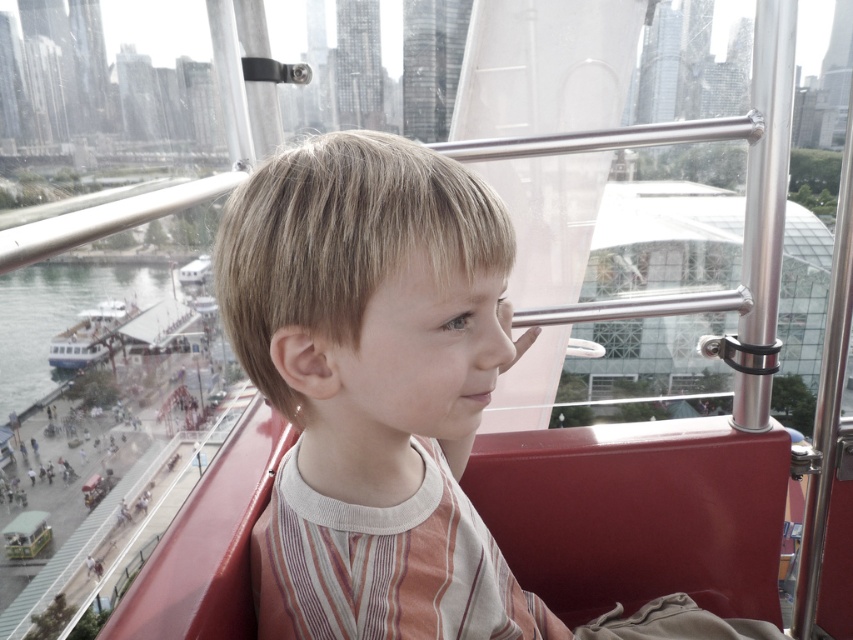
Question: Can you confirm if light brown hair at center is positioned to the right of white matte boat at lower left?

Choices:
 (A) no
 (B) yes

Answer: (B)

Question: Does light brown hair at center appear on the left side of white matte boat at lower left?

Choices:
 (A) no
 (B) yes

Answer: (A)

Question: Which of the following is the closest to the observer?

Choices:
 (A) white matte boat at lower left
 (B) light brown hair at center

Answer: (B)

Question: Can you confirm if light brown hair at center is bigger than white matte boat at lower left?

Choices:
 (A) no
 (B) yes

Answer: (A)

Question: Which of the following is the farthest from the observer?

Choices:
 (A) (93, 356)
 (B) (511, 236)

Answer: (A)